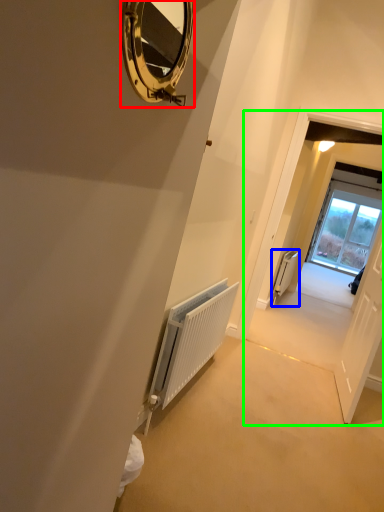
Question: Estimate the real-world distances between objects in this image. Which object is farther from mirror (highlighted by a red box), radiator (highlighted by a blue box) or corridor (highlighted by a green box)?

Choices:
 (A) radiator
 (B) corridor

Answer: (A)